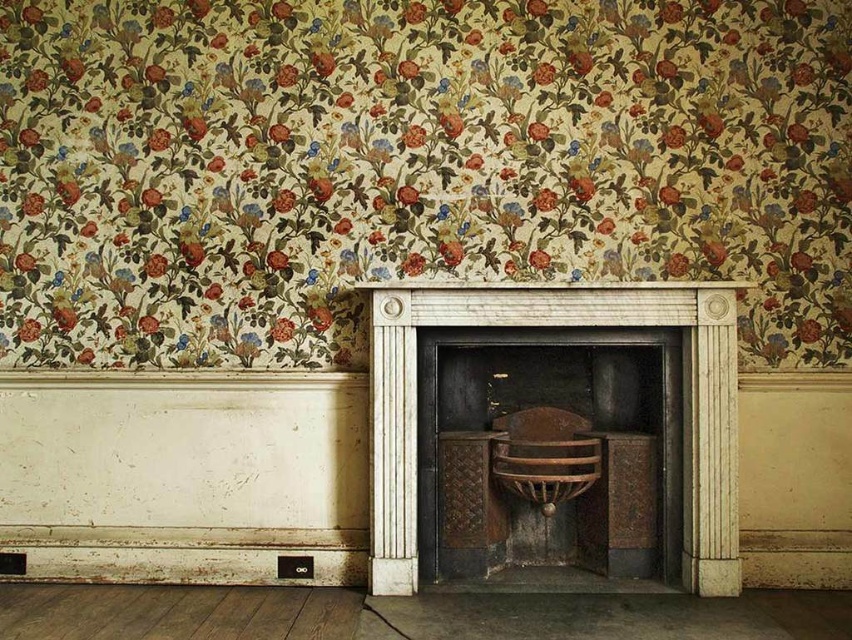
Does white marble fireplace at center have a greater width compared to wooden armchair at center?

Yes, white marble fireplace at center is wider than wooden armchair at center.

Can you confirm if white marble fireplace at center is smaller than wooden armchair at center?

No.

The image size is (852, 640). Identify the location of white marble fireplace at center. (559, 326).